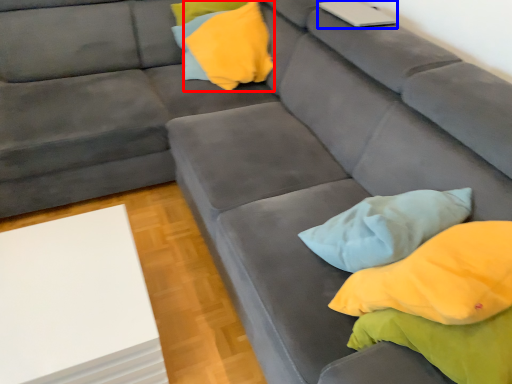
Question: Which of the following is the closest to the observer, pillow (highlighted by a red box) or laptop (highlighted by a blue box)?

Choices:
 (A) pillow
 (B) laptop

Answer: (B)